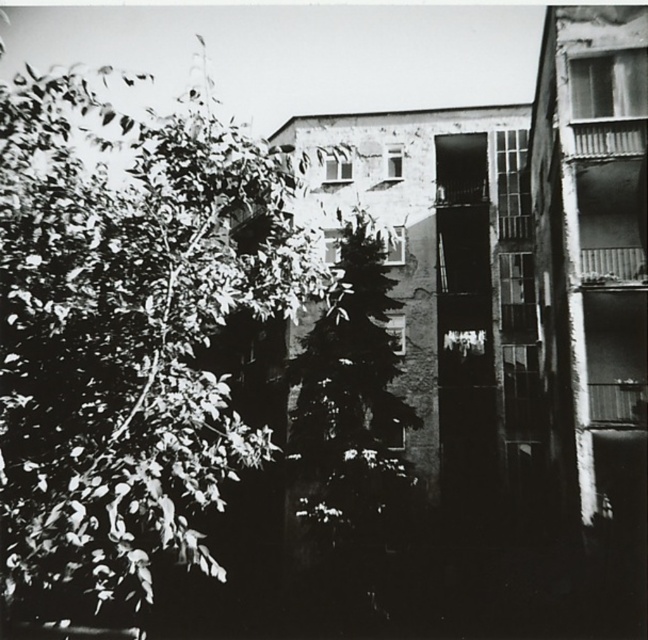
Which is above, green leafy tree at left or dark green textured tree at center?

green leafy tree at left is above.

Which is behind, point (181, 122) or point (356, 410)?

The point (356, 410) is more distant.

Where is `green leafy tree at left`? green leafy tree at left is located at coordinates (128, 332).